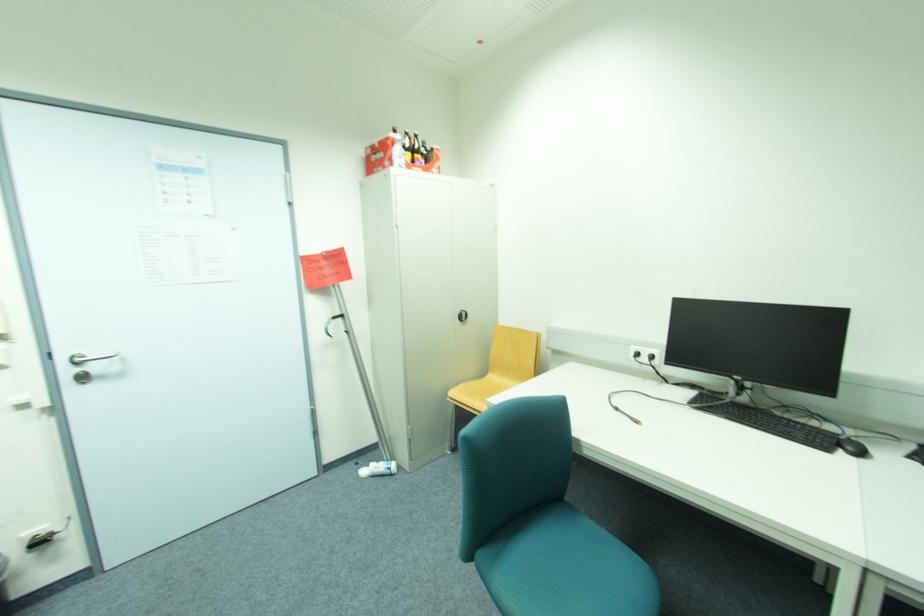
Image resolution: width=924 pixels, height=616 pixels. What are the coordinates of `yellow chair sitting surface` in the screenshot? It's located at (487, 387).